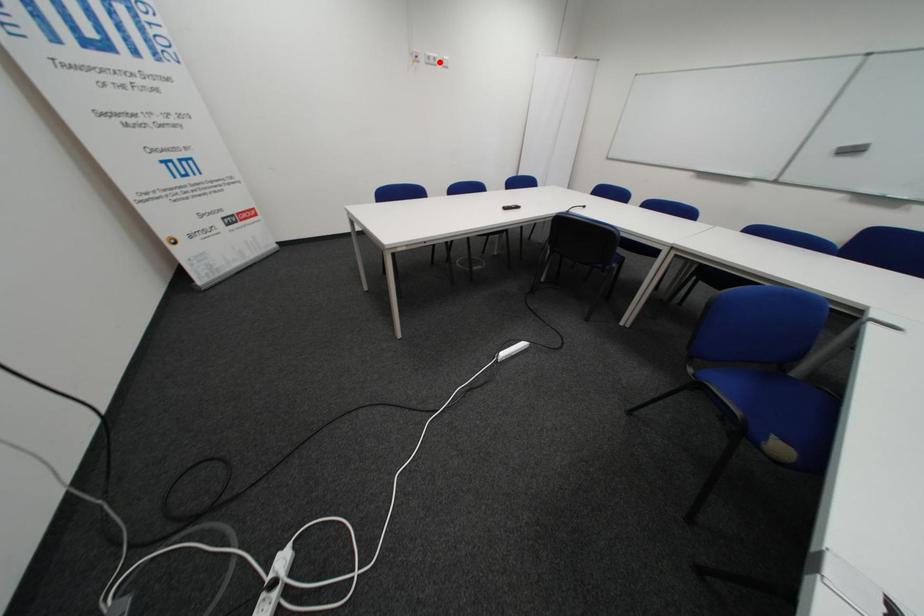
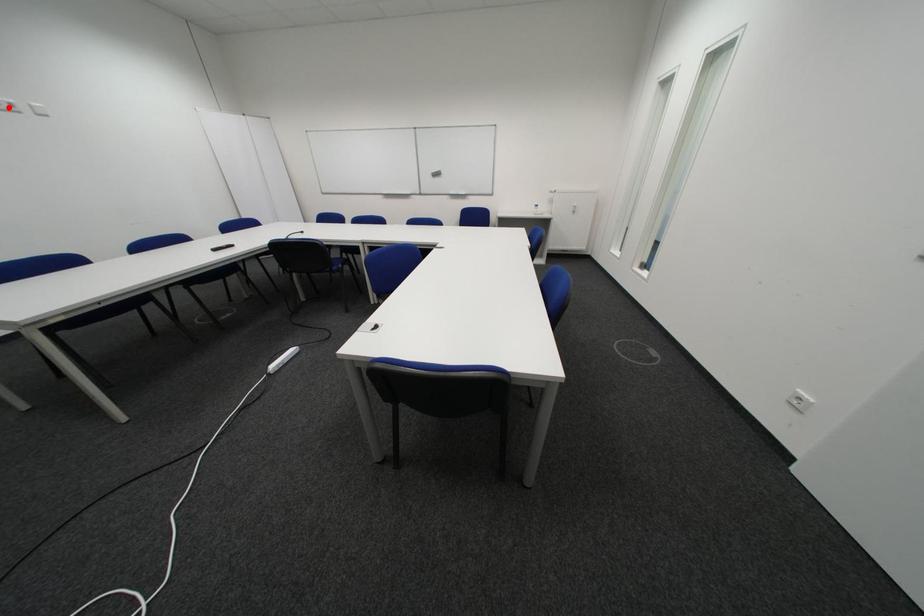
I am providing you with two images of the same scene from different viewpoints. A red point is marked on the first image and another point is marked on the second image. Is the marked point in image1 the same physical position as the marked point in image2?

Yes